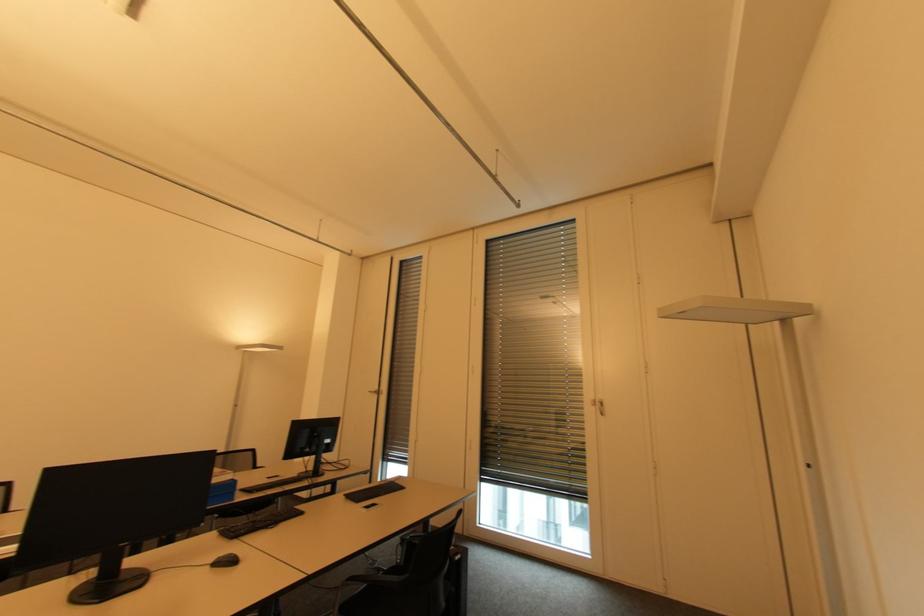
Find where to sit the chair sitting surface. Please return your answer as a coordinate pair (x, y).

(390, 594)